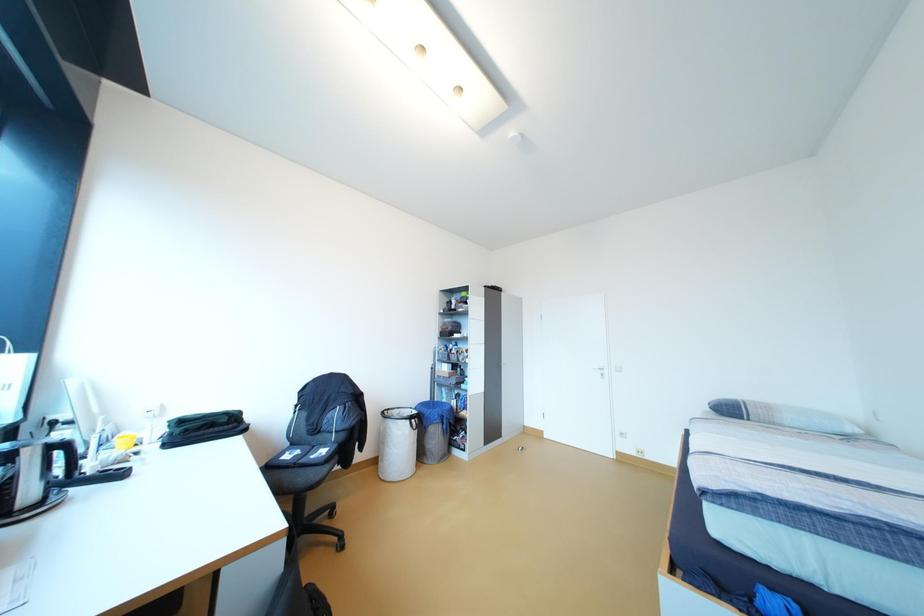
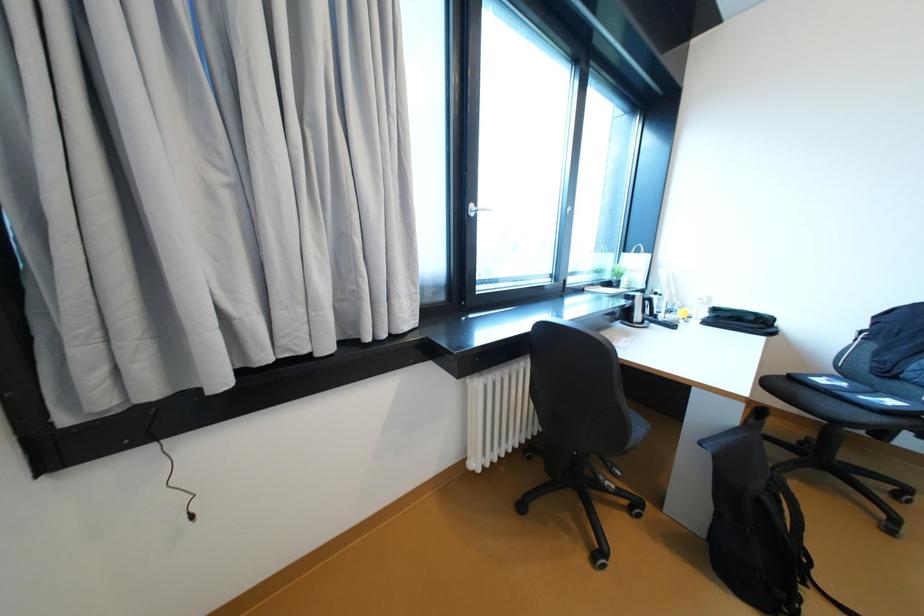
Question: The camera is either moving clockwise (left) or counter-clockwise (right) around the object. The first image is from the beginning of the video and the second image is from the end. Is the camera moving left or right when shooting the video?

Choices:
 (A) Left
 (B) Right

Answer: (B)